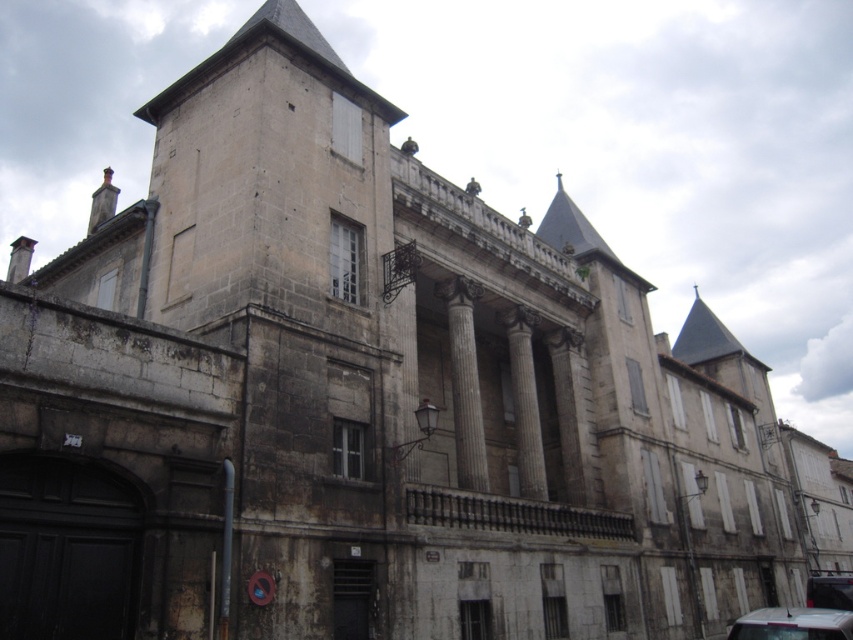
Question: Which of the following is the farthest from the observer?

Choices:
 (A) (827, 611)
 (B) (822, 579)

Answer: (B)

Question: Estimate the real-world distances between objects in this image. Which object is farther from the smooth stone column at center?

Choices:
 (A) metallic silver car at lower right
 (B) white glossy car at lower right

Answer: (A)

Question: Is white glossy car at lower right smaller than metallic silver car at lower right?

Choices:
 (A) no
 (B) yes

Answer: (B)

Question: Does smooth stone column at center appear on the right side of white glossy car at lower right?

Choices:
 (A) yes
 (B) no

Answer: (B)

Question: Which of the following is the farthest from the observer?

Choices:
 (A) (849, 576)
 (B) (834, 612)

Answer: (A)

Question: Is smooth stone column at center behind metallic silver car at lower right?

Choices:
 (A) no
 (B) yes

Answer: (A)